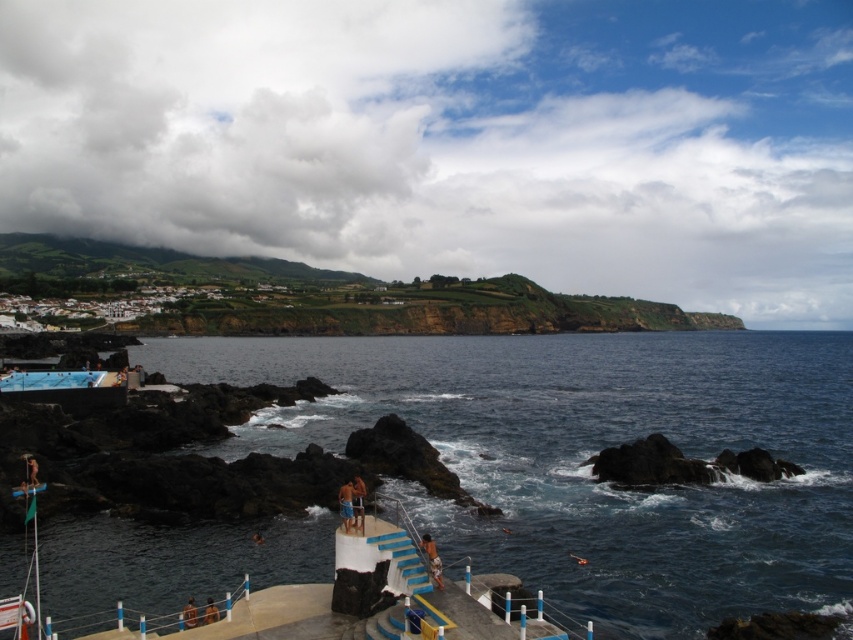
You are a photographer positioned at the edge of the pier. You want to capture both the tan skin person at lower center and the tan skin person at center in the same frame. Which direction should you adjust your camera to include both?

To include both the tan skin person at lower center and the tan skin person at center in the frame, you should adjust your camera to the left since the tan skin person at lower center is to the right of the tan skin person at center.

You are a photographer standing on the pier and want to capture both the blue fabric shorts at lower center and the brown leather surfboard at lower center in your shot. Which object should you focus on first if you want to ensure both are in the frame?

You should focus on the blue fabric shorts at lower center first because it is taller than the brown leather surfboard at lower center, allowing you to frame both effectively.

You are a swimmer planning to jump into the dark blue water at center from the pier. Before jumping, you notice the brown fabric shorts at lower center. Which object takes up more space in the image?

The dark blue water at center takes up more space in the image than the brown fabric shorts at lower center because it is larger in size.